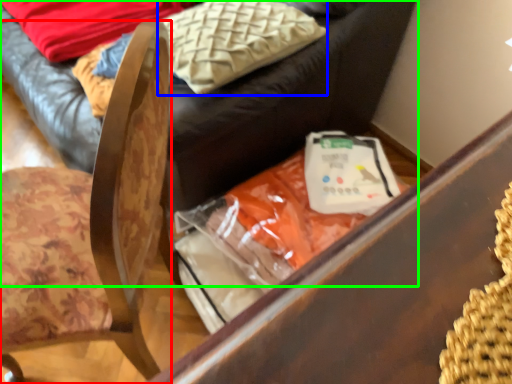
Question: Based on their relative distances, which object is farther from chair (highlighted by a red box)? Choose from pillow (highlighted by a blue box) and furniture (highlighted by a green box).

Choices:
 (A) pillow
 (B) furniture

Answer: (B)